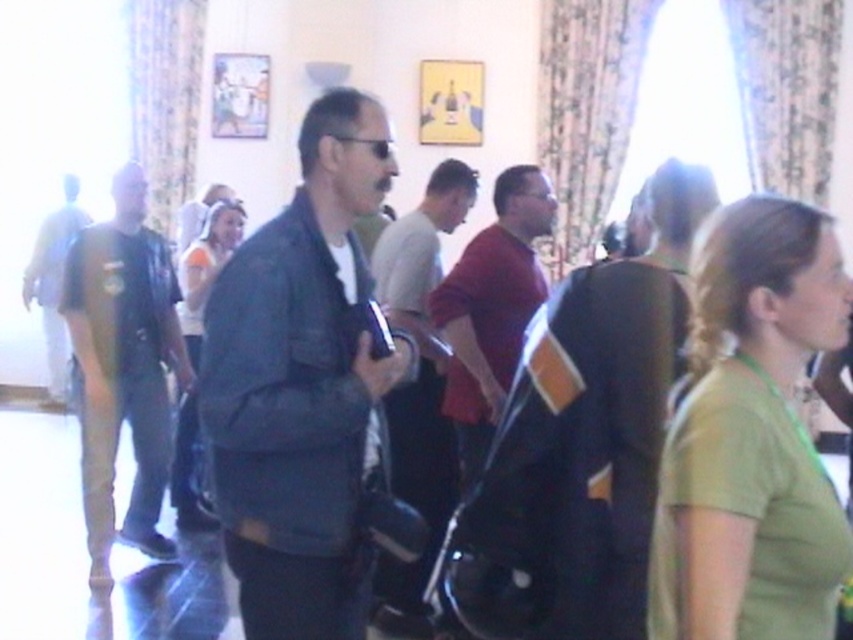
Question: Considering the relative positions of green fabric shirt at center and dark gray jacket at center in the image provided, where is green fabric shirt at center located with respect to dark gray jacket at center?

Choices:
 (A) below
 (B) above

Answer: (B)

Question: Which of the following is the closest to the observer?

Choices:
 (A) (469, 368)
 (B) (91, 484)

Answer: (A)

Question: Which point appears farthest from the camera in this image?

Choices:
 (A) (660, 164)
 (B) (506, 262)
 (C) (425, 444)

Answer: (C)

Question: Can you confirm if green matte shirt at center is positioned below dark gray jacket at center?

Choices:
 (A) no
 (B) yes

Answer: (A)

Question: Among these points, which one is nearest to the camera?

Choices:
 (A) (466, 372)
 (B) (546, 528)
 (C) (28, 282)

Answer: (B)

Question: Observing the image, what is the correct spatial positioning of green matte shirt at center in reference to green fabric shirt at center?

Choices:
 (A) below
 (B) above

Answer: (A)